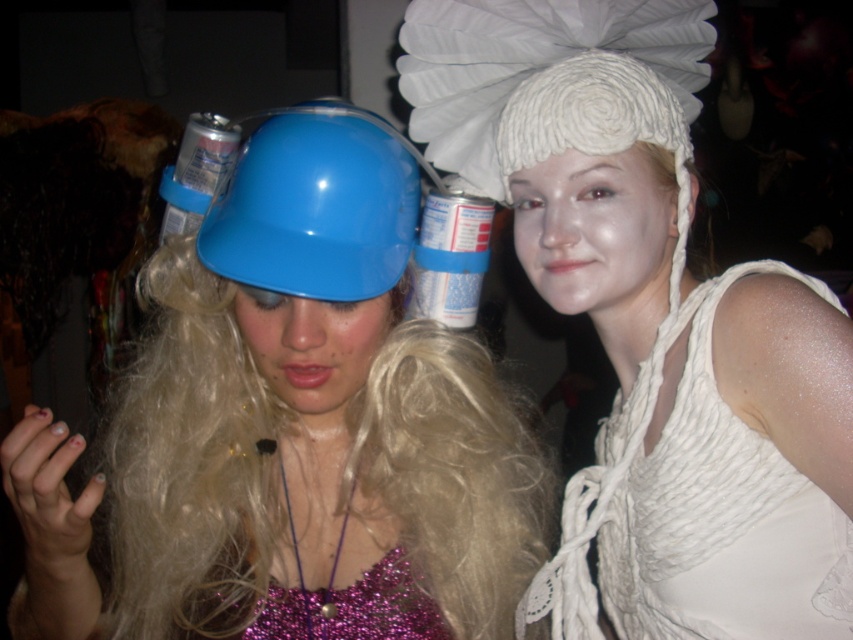
Is matte plastic helmet at center further to the viewer compared to white knitted dress at upper right?

No, it is in front of white knitted dress at upper right.

Is matte plastic helmet at center to the right of white knitted dress at upper right from the viewer's perspective?

Incorrect, matte plastic helmet at center is not on the right side of white knitted dress at upper right.

Is point (337, 168) in front of point (621, 577)?

Yes, point (337, 168) is in front of point (621, 577).

Locate an element on the screen. This screenshot has height=640, width=853. matte plastic helmet at center is located at coordinates (312, 406).

Is matte plastic helmet at center to the right of white knitted hat at upper center from the viewer's perspective?

Incorrect, matte plastic helmet at center is not on the right side of white knitted hat at upper center.

Does matte plastic helmet at center have a greater height compared to white knitted hat at upper center?

No, matte plastic helmet at center is not taller than white knitted hat at upper center.

Is point (337, 186) farther from camera compared to point (462, 68)?

No, it is in front of (462, 68).

Locate an element on the screen. matte plastic helmet at center is located at coordinates (312, 406).

Who is more distant from viewer, (163, 326) or (381, 262)?

Positioned behind is point (163, 326).

Which is below, matte plastic helmet at center or blue glossy helmet at center?

matte plastic helmet at center

Who is more distant from viewer, (548, 481) or (323, 225)?

The point (548, 481) is more distant.

Find the location of a particular element. matte plastic helmet at center is located at coordinates (312, 406).